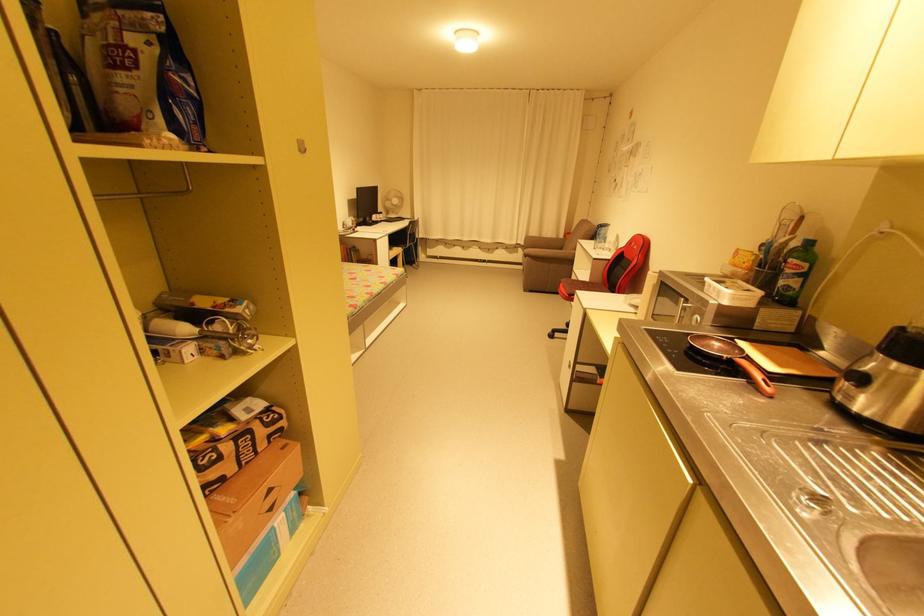
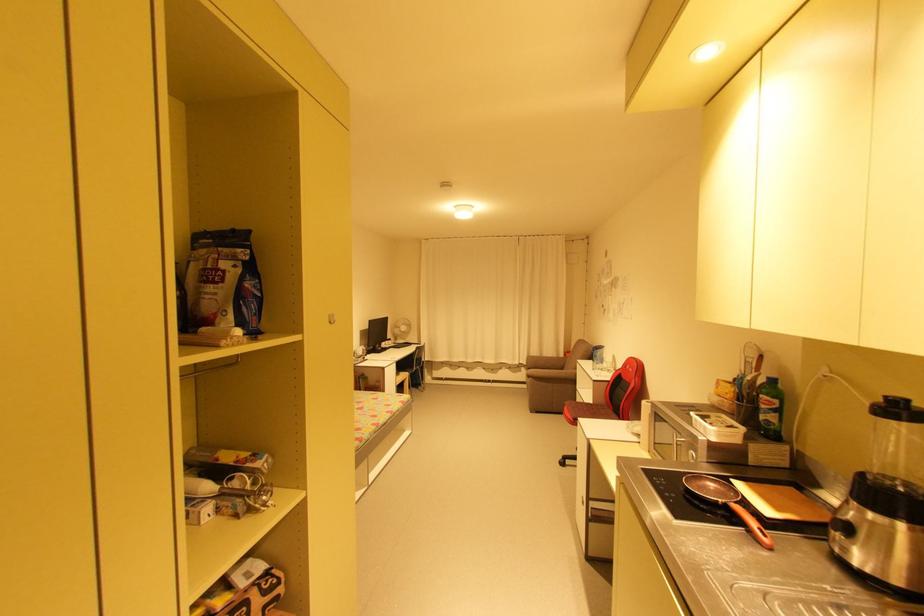
Question: I am providing you with two images of the same scene from different viewpoints. Which of the following objects are not visible in image2?

Choices:
 (A) blue water pitcher
 (B) small white hook
 (C) white desk fan
 (D) none of these

Answer: (D)